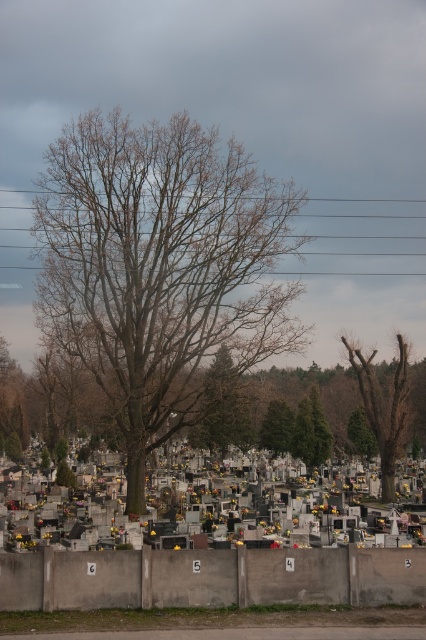
Question: Among these objects, which one is farthest from the camera?

Choices:
 (A) bare wood tree at right
 (B) green textured tree at center
 (C) green matte tree at center

Answer: (C)

Question: Can you confirm if bare wood tree at center is bigger than bare wood tree at right?

Choices:
 (A) no
 (B) yes

Answer: (B)

Question: Which is nearer to the bare wood tree at right?

Choices:
 (A) green matte tree at center
 (B) green textured tree at center
 (C) concrete wall at lower center
 (D) bare wood tree at center

Answer: (B)

Question: Estimate the real-world distances between objects in this image. Which object is farther from the green textured tree at center?

Choices:
 (A) concrete wall at lower center
 (B) bare wood tree at right
 (C) bare wood tree at center

Answer: (A)

Question: Is bare wood tree at center closer to camera compared to green textured tree at center?

Choices:
 (A) yes
 (B) no

Answer: (A)

Question: Considering the relative positions of bare wood tree at center and bare wood tree at right in the image provided, where is bare wood tree at center located with respect to bare wood tree at right?

Choices:
 (A) below
 (B) above

Answer: (B)